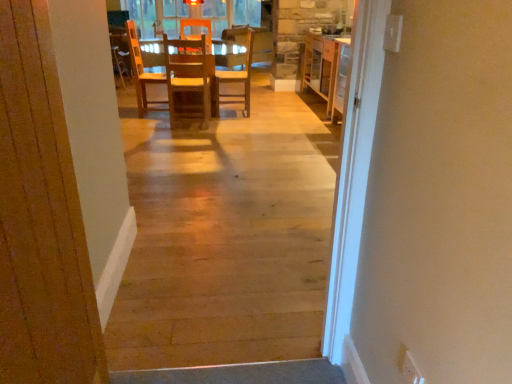
Question: Does natural wood floor at center have a smaller size compared to wooden cabinet at center?

Choices:
 (A) yes
 (B) no

Answer: (A)

Question: Is natural wood floor at center facing away from wooden cabinet at center?

Choices:
 (A) no
 (B) yes

Answer: (A)

Question: Does natural wood floor at center turn towards wooden cabinet at center?

Choices:
 (A) yes
 (B) no

Answer: (A)

Question: Can you see natural wood floor at center touching wooden cabinet at center?

Choices:
 (A) yes
 (B) no

Answer: (B)

Question: Is natural wood floor at center bigger than wooden cabinet at center?

Choices:
 (A) yes
 (B) no

Answer: (B)

Question: Is wooden door at center inside the boundaries of wooden chair at center, acting as the first chair starting from the right, or outside?

Choices:
 (A) inside
 (B) outside

Answer: (B)

Question: Visually, is wooden door at center positioned to the left or to the right of wooden chair at center, acting as the first chair starting from the right?

Choices:
 (A) left
 (B) right

Answer: (A)

Question: In the image, is wooden door at center positioned in front of or behind wooden chair at center, positioned as the 2th chair in left-to-right order?

Choices:
 (A) front
 (B) behind

Answer: (A)

Question: From the image's perspective, is wooden door at center located above or below wooden chair at center, positioned as the 2th chair in left-to-right order?

Choices:
 (A) below
 (B) above

Answer: (A)

Question: Considering the relative positions of wooden door at center and natural wood floor at center in the image provided, is wooden door at center to the left or to the right of natural wood floor at center?

Choices:
 (A) right
 (B) left

Answer: (B)

Question: From the image's perspective, is wooden door at center positioned above or below natural wood floor at center?

Choices:
 (A) above
 (B) below

Answer: (B)

Question: Considering the positions of wooden door at center and natural wood floor at center in the image, is wooden door at center bigger or smaller than natural wood floor at center?

Choices:
 (A) small
 (B) big

Answer: (A)

Question: From a real-world perspective, is wooden door at center physically located above or below natural wood floor at center?

Choices:
 (A) below
 (B) above

Answer: (B)

Question: Relative to natural wood floor at center, is wooden cabinet at center in front or behind?

Choices:
 (A) behind
 (B) front

Answer: (A)

Question: From the image's perspective, is wooden cabinet at center above or below natural wood floor at center?

Choices:
 (A) above
 (B) below

Answer: (A)